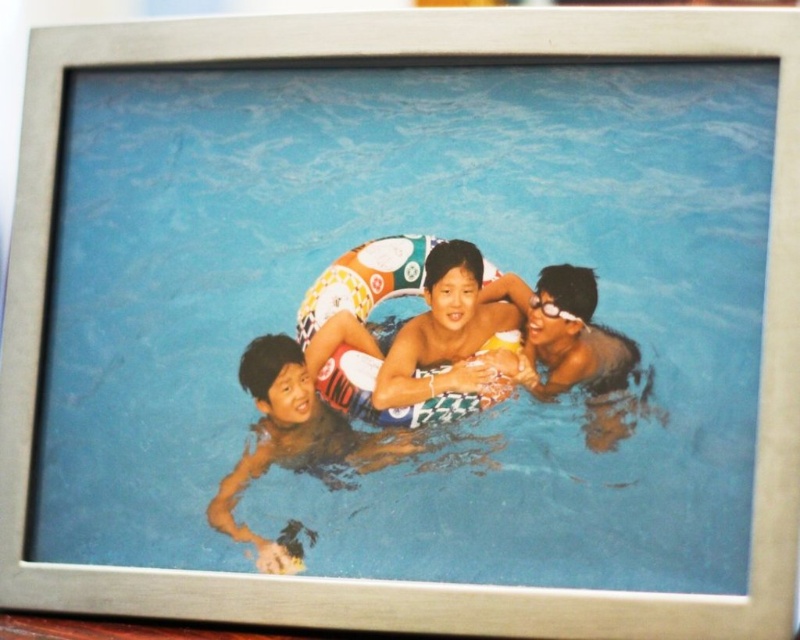
Question: In this image, where is smooth skin boy at center located relative to glossy black swimmer at center?

Choices:
 (A) left
 (B) right

Answer: (A)

Question: Is smooth skin boy at center below glossy black swimmer at center?

Choices:
 (A) no
 (B) yes

Answer: (B)

Question: Which point is closer to the camera?

Choices:
 (A) (548, 368)
 (B) (254, 538)

Answer: (B)

Question: Which object appears closest to the camera in this image?

Choices:
 (A) smooth skin boy at center
 (B) glossy black swimmer at center

Answer: (B)

Question: Which of the following is the closest to the observer?

Choices:
 (A) (258, 552)
 (B) (462, 381)
 (C) (544, 348)

Answer: (A)

Question: Does smooth skin boy at center appear over smooth yellow lifebuoy at center?

Choices:
 (A) yes
 (B) no

Answer: (B)